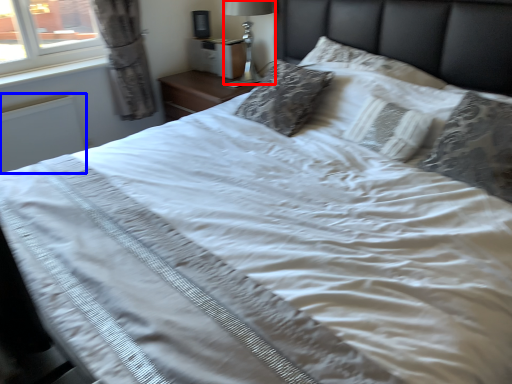
Question: Which point is further to the camera, bedside lamp (highlighted by a red box) or radiator (highlighted by a blue box)?

Choices:
 (A) bedside lamp
 (B) radiator

Answer: (A)